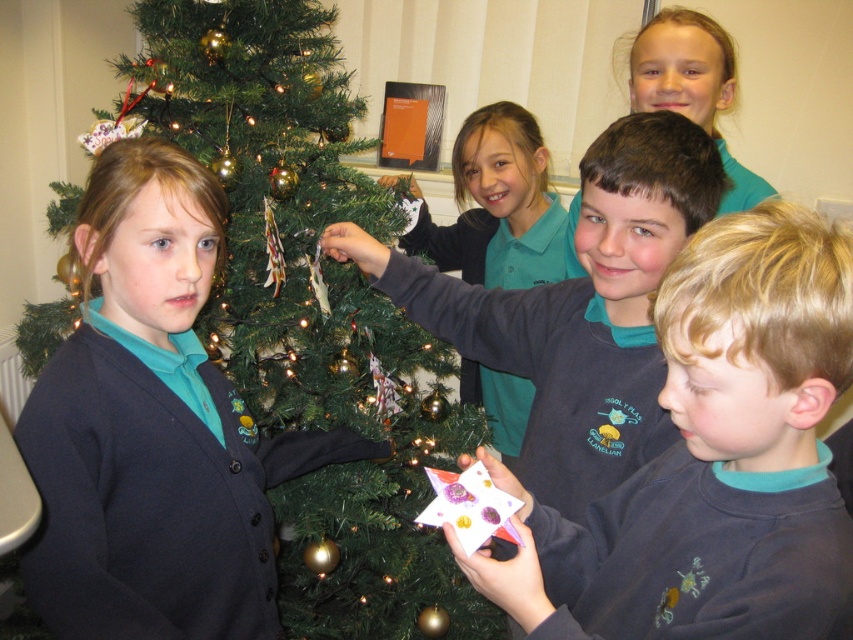
Question: Considering the real-world distances, which object is farthest from the teal fabric shirt at upper center?

Choices:
 (A) teal jersey at center
 (B) green matte christmas tree at left
 (C) dark blue sweatshirt at center
 (D) matte gray sweater at center

Answer: (C)

Question: Among these points, which one is nearest to the camera?

Choices:
 (A) (190, 88)
 (B) (492, 195)

Answer: (A)

Question: Does dark blue sweatshirt at center have a smaller size compared to matte gray sweater at center?

Choices:
 (A) no
 (B) yes

Answer: (B)

Question: Which object is farther from the camera taking this photo?

Choices:
 (A) green matte christmas tree at left
 (B) dark blue sweatshirt at center
 (C) matte gray sweater at center
 (D) teal jersey at center

Answer: (D)

Question: Observing the image, what is the correct spatial positioning of matte gray sweater at center in reference to teal jersey at center?

Choices:
 (A) right
 (B) left

Answer: (A)

Question: Does dark blue sweatshirt at center have a smaller size compared to teal jersey at center?

Choices:
 (A) no
 (B) yes

Answer: (B)